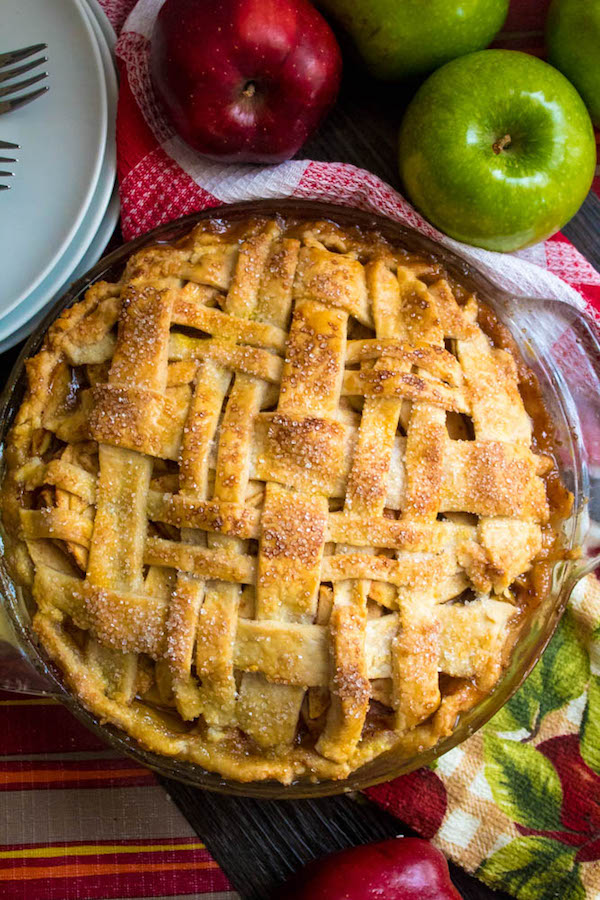
You are a GUI agent. You are given a task and a screenshot of the screen. Output one action in this format:
    pyautogui.click(x=<x>, y=<y>)
    Task: Click on the kitchen hand towel
    This screenshot has height=900, width=600.
    Given the screenshot: What is the action you would take?
    pyautogui.click(x=527, y=825), pyautogui.click(x=557, y=745), pyautogui.click(x=562, y=699), pyautogui.click(x=477, y=783), pyautogui.click(x=550, y=805)